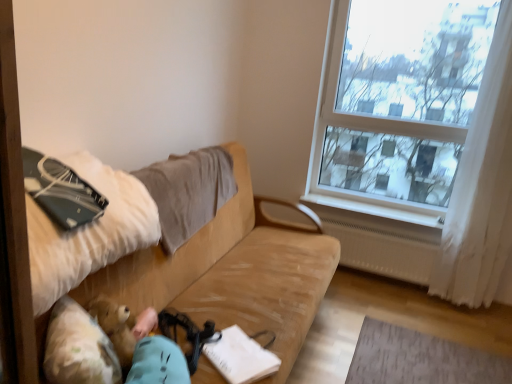
Question: Can you confirm if white paper at center is positioned to the left of white plastic radiator at lower right?

Choices:
 (A) yes
 (B) no

Answer: (A)

Question: Considering the relative sizes of white paper at center and white plastic radiator at lower right in the image provided, is white paper at center taller than white plastic radiator at lower right?

Choices:
 (A) no
 (B) yes

Answer: (B)

Question: Would you consider white paper at center to be distant from white plastic radiator at lower right?

Choices:
 (A) no
 (B) yes

Answer: (B)

Question: Is white paper at center closer to camera compared to white plastic radiator at lower right?

Choices:
 (A) no
 (B) yes

Answer: (B)

Question: Considering the relative positions of white paper at center and white plastic radiator at lower right in the image provided, is white paper at center to the right of white plastic radiator at lower right from the viewer's perspective?

Choices:
 (A) no
 (B) yes

Answer: (A)

Question: Is white paper at center further to camera compared to white plastic radiator at lower right?

Choices:
 (A) no
 (B) yes

Answer: (A)

Question: Is beige fabric pillow at upper left positioned in front of beige fabric couch at center?

Choices:
 (A) no
 (B) yes

Answer: (A)

Question: Does beige fabric pillow at upper left have a lesser width compared to beige fabric couch at center?

Choices:
 (A) no
 (B) yes

Answer: (B)

Question: Is beige fabric pillow at upper left turned away from beige fabric couch at center?

Choices:
 (A) no
 (B) yes

Answer: (B)

Question: Is beige fabric pillow at upper left next to beige fabric couch at center and touching it?

Choices:
 (A) no
 (B) yes

Answer: (A)

Question: Can you confirm if beige fabric pillow at upper left is taller than beige fabric couch at center?

Choices:
 (A) no
 (B) yes

Answer: (A)

Question: From the image's perspective, does beige fabric pillow at upper left appear lower than beige fabric couch at center?

Choices:
 (A) no
 (B) yes

Answer: (A)

Question: Does matte black notebook at left have a larger size compared to beige fabric pillow at upper left?

Choices:
 (A) no
 (B) yes

Answer: (A)